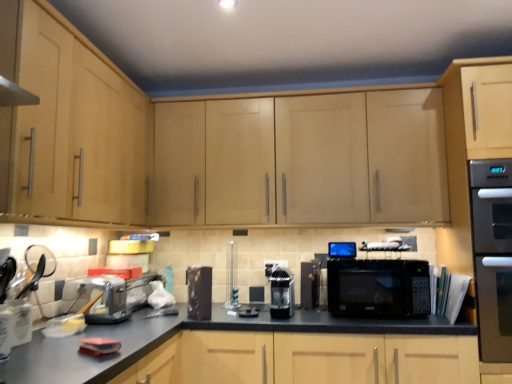
What is the approximate height of black glossy coffee maker at center, positioned as the fourth appliance in right-to-left order?

black glossy coffee maker at center, positioned as the fourth appliance in right-to-left order, is 10.32 inches tall.

This screenshot has width=512, height=384. What do you see at coordinates (199, 292) in the screenshot?
I see `black glossy coffee maker at center, which is the 2th appliance from left to right` at bounding box center [199, 292].

What is the approximate height of black matte microwave at center?

black matte microwave at center is 11.06 inches in height.

Locate an element on the screen. This screenshot has height=384, width=512. light wood cabinet at upper center, the second cabinetry viewed from the left is located at coordinates (302, 160).

The image size is (512, 384). I want to click on black glossy microwave at center, acting as the first appliance starting from the right, so click(x=342, y=249).

Locate an element on the screen. metallic silver toaster at left, the 5th appliance in the right-to-left sequence is located at coordinates (110, 296).

From the image's perspective, does black glossy microwave at center, acting as the first appliance starting from the right, appear lower than light wood cabinet at upper center, the first cabinetry when ordered from right to left?

Yes.

Is black glossy microwave at center, acting as the first appliance starting from the right, turned away from light wood cabinet at upper center, the second cabinetry viewed from the left?

No, black glossy microwave at center, acting as the first appliance starting from the right, is not facing the opposite direction of light wood cabinet at upper center, the second cabinetry viewed from the left.

Considering the positions of objects black glossy microwave at center, the 5th appliance from the left, and light wood cabinet at upper center, the second cabinetry viewed from the left, in the image provided, who is more to the left, black glossy microwave at center, the 5th appliance from the left, or light wood cabinet at upper center, the second cabinetry viewed from the left,?

light wood cabinet at upper center, the second cabinetry viewed from the left.

Considering the positions of objects black glossy microwave at center, acting as the first appliance starting from the right, and light wood cabinet at upper center, the first cabinetry when ordered from right to left, in the image provided, who is behind, black glossy microwave at center, acting as the first appliance starting from the right, or light wood cabinet at upper center, the first cabinetry when ordered from right to left,?

black glossy microwave at center, acting as the first appliance starting from the right, is further from the camera.

From the image's perspective, which is below, black matte microwave at center or light wood cabinet at upper center, the first cabinetry when ordered from right to left?

black matte microwave at center appears lower in the image.

Is black matte microwave at center beside light wood cabinet at upper center, the second cabinetry viewed from the left?

No, black matte microwave at center is not making contact with light wood cabinet at upper center, the second cabinetry viewed from the left.

Which is correct: black matte microwave at center is inside light wood cabinet at upper center, the first cabinetry when ordered from right to left, or outside of it?

The correct answer is: outside.

Measure the distance between black matte microwave at center and light wood cabinet at upper center, the second cabinetry viewed from the left.

The distance of black matte microwave at center from light wood cabinet at upper center, the second cabinetry viewed from the left, is 20.78 inches.

Consider the image. How much distance is there between stainless steel oven at right and black glossy coffee maker at center, positioned as the fourth appliance in right-to-left order?

stainless steel oven at right and black glossy coffee maker at center, positioned as the fourth appliance in right-to-left order, are 4.24 feet apart from each other.

Is stainless steel oven at right surrounding black glossy coffee maker at center, positioned as the fourth appliance in right-to-left order?

No, stainless steel oven at right does not contain black glossy coffee maker at center, positioned as the fourth appliance in right-to-left order.

Based on the photo, visually, is stainless steel oven at right positioned to the left or to the right of black glossy coffee maker at center, positioned as the fourth appliance in right-to-left order?

Based on their positions, stainless steel oven at right is located to the right of black glossy coffee maker at center, positioned as the fourth appliance in right-to-left order.

Is point (485, 200) farther from viewer compared to point (199, 303)?

No, (485, 200) is closer to viewer.

Based on the photo, what's the angular difference between stainless steel oven at right and black matte countertop at center's facing directions?

The facing directions of stainless steel oven at right and black matte countertop at center are 0.117 degrees apart.

The image size is (512, 384). I want to click on home appliance that is above the black matte countertop at center (from the image's perspective), so click(492, 254).

In terms of height, does stainless steel oven at right look taller or shorter compared to black matte countertop at center?

Clearly, stainless steel oven at right is taller compared to black matte countertop at center.

Does point (347, 280) come farther from viewer compared to point (301, 273)?

No, (347, 280) is closer to viewer.

Is black matte microwave at center in front of black plastic microwave at center, acting as the 2th appliance starting from the right?

Yes, black matte microwave at center is in front of black plastic microwave at center, acting as the 2th appliance starting from the right.

What are the coordinates of `appliance that is the 1st object above the black matte microwave at center (from a real-world perspective)` in the screenshot? It's located at (310, 284).

Does metallic silver toaster at left, the 5th appliance in the right-to-left sequence, turn towards stainless steel oven at right?

Yes, metallic silver toaster at left, the 5th appliance in the right-to-left sequence, is turned towards stainless steel oven at right.

Which is correct: metallic silver toaster at left, the 1th appliance positioned from the left, is inside stainless steel oven at right, or outside of it?

metallic silver toaster at left, the 1th appliance positioned from the left, is not enclosed by stainless steel oven at right.

Looking at this image, considering the sizes of metallic silver toaster at left, the 1th appliance positioned from the left, and stainless steel oven at right in the image, is metallic silver toaster at left, the 1th appliance positioned from the left, wider or thinner than stainless steel oven at right?

Clearly, metallic silver toaster at left, the 1th appliance positioned from the left, has less width compared to stainless steel oven at right.

Considering the sizes of objects stainless steel oven at right and black plastic microwave at center, which is the 4th appliance from left to right, in the image provided, who is taller, stainless steel oven at right or black plastic microwave at center, which is the 4th appliance from left to right,?

stainless steel oven at right is taller.

Is the depth of stainless steel oven at right greater than that of black plastic microwave at center, acting as the 2th appliance starting from the right?

No.

Which is more to the left, stainless steel oven at right or black plastic microwave at center, acting as the 2th appliance starting from the right?

Positioned to the left is black plastic microwave at center, acting as the 2th appliance starting from the right.

I want to click on home appliance on the right of black plastic microwave at center, which is the 4th appliance from left to right, so click(492, 254).

This screenshot has height=384, width=512. In order to click on the 1st appliance below when counting from the light wood cabinet at upper center, the first cabinetry when ordered from right to left (from the image's perspective) in this screenshot , I will do `click(342, 249)`.

The height and width of the screenshot is (384, 512). Find the location of `cabinetry that is behind the black matte microwave at center`. cabinetry that is behind the black matte microwave at center is located at coordinates (302, 160).

Based on their spatial positions, is black matte microwave at center or black glossy microwave at center, acting as the first appliance starting from the right, further from light wood cabinet at upper center, the second cabinetry viewed from the left?

The object further to light wood cabinet at upper center, the second cabinetry viewed from the left, is black glossy microwave at center, acting as the first appliance starting from the right.

Based on their spatial positions, is metallic silver toaster at left, the 5th appliance in the right-to-left sequence, or sleek black coffee machine at center, marked as the 3th appliance in a right-to-left arrangement, further from stainless steel oven at right?

Based on the image, metallic silver toaster at left, the 5th appliance in the right-to-left sequence, appears to be further to stainless steel oven at right.

Considering their positions, is black matte countertop at center positioned further to stainless steel oven at right than black glossy coffee maker at center, which is the 2th appliance from left to right?

black glossy coffee maker at center, which is the 2th appliance from left to right.

Which object lies nearer to the anchor point black plastic microwave at center, acting as the 2th appliance starting from the right, black glossy microwave at center, the 5th appliance from the left, or sleek black coffee machine at center, marked as the 3th appliance in a right-to-left arrangement?

Among the two, black glossy microwave at center, the 5th appliance from the left, is located nearer to black plastic microwave at center, acting as the 2th appliance starting from the right.

Estimate the real-world distances between objects in this image. Which object is further from metallic silver toaster at left, the 1th appliance positioned from the left, black matte microwave at center or black glossy microwave at center, acting as the first appliance starting from the right?

black matte microwave at center is further to metallic silver toaster at left, the 1th appliance positioned from the left.

Looking at the image, which one is located further to light wood cabinet at left, the 1th cabinetry viewed from the left, light wood cabinet at upper center, the second cabinetry viewed from the left, or metallic silver toaster at left, the 1th appliance positioned from the left?

The object further to light wood cabinet at left, the 1th cabinetry viewed from the left, is light wood cabinet at upper center, the second cabinetry viewed from the left.

Looking at the image, which one is located further to black glossy coffee maker at center, which is the 2th appliance from left to right, black plastic microwave at center, which is the 4th appliance from left to right, or sleek black coffee machine at center, which appears as the third appliance when viewed from the left?

The object further to black glossy coffee maker at center, which is the 2th appliance from left to right, is black plastic microwave at center, which is the 4th appliance from left to right.

Considering their positions, is black matte countertop at center positioned closer to black matte microwave at center than light wood cabinet at left, marked as the second cabinetry in a right-to-left arrangement?

black matte countertop at center lies closer to black matte microwave at center than the other object.

I want to click on microwave oven located between black plastic microwave at center, acting as the 2th appliance starting from the right, and stainless steel oven at right in the left-right direction, so click(378, 288).

Identify the location of counter top between light wood cabinet at upper center, the first cabinetry when ordered from right to left, and stainless steel oven at right. This screenshot has height=384, width=512. (191, 329).

Locate an element on the screen. This screenshot has width=512, height=384. microwave oven between black matte countertop at center and black plastic microwave at center, which is the 4th appliance from left to right, in the front-back direction is located at coordinates (378, 288).

Identify the location of cabinetry between metallic silver toaster at left, the 1th appliance positioned from the left, and black matte countertop at center, in the horizontal direction. (302, 160).